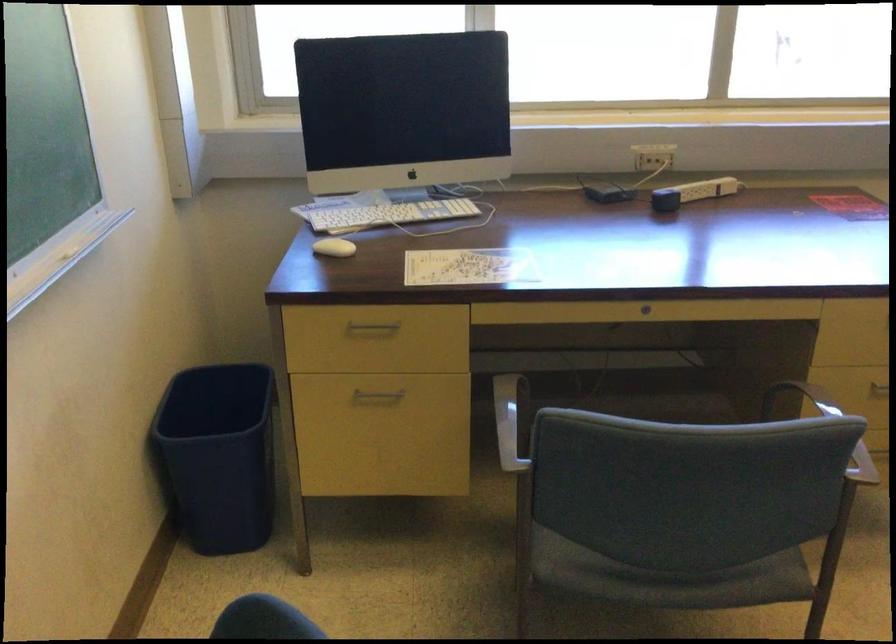
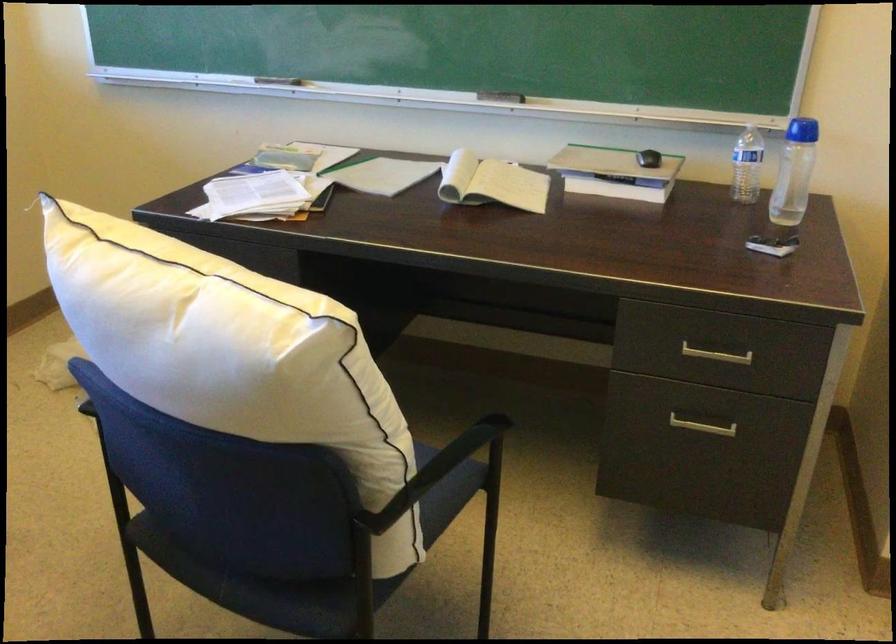
Question: The images are taken continuously from a first-person perspective. In which direction is your viewpoint rotating?

Choices:
 (A) Left
 (B) Right
 (C) Up
 (D) Down

Answer: (B)